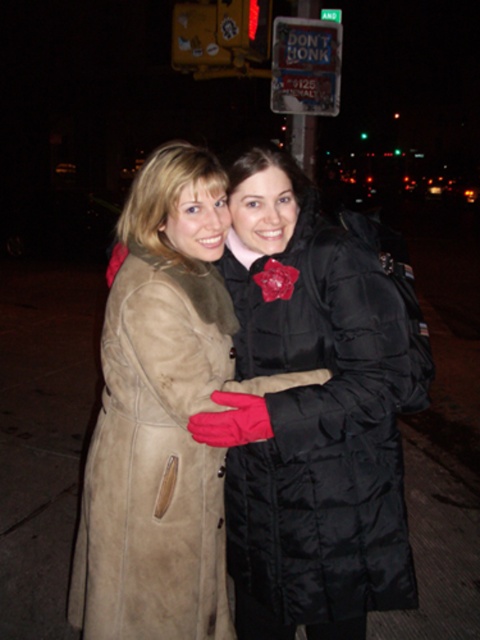
You are a photographer trying to capture the two people in the image. You want to ensure that both the suede coat at center and the suede coat at left are clearly visible in your photo. Based on their positions, which coat should you focus on first to ensure both are in focus?

The suede coat at center is in front of the suede coat at left, so focusing on the suede coat at center first will ensure both are in focus as the suede coat at left is behind it.

You are a photographer standing 1.5 meters away from the camera. You want to take a photo of the suede coat at center. Can you reach the coat to adjust its position without moving the camera?

The suede coat at center is 1.41 meters away from the camera. Since you are standing 1.5 meters away from the camera, you are 0.09 meters farther than the coat. Therefore, you can reach the coat to adjust its position without moving the camera.

You are taking a photo of two friends standing in front of you. You notice two points on their clothing that you want to focus on. One is at point (90, 612) and the other at point (156, 573). Which point should you focus on to ensure it appears clearer in the photo?

You should focus on point (90, 612) because it is closer to the camera and thus will appear clearer in the photo.